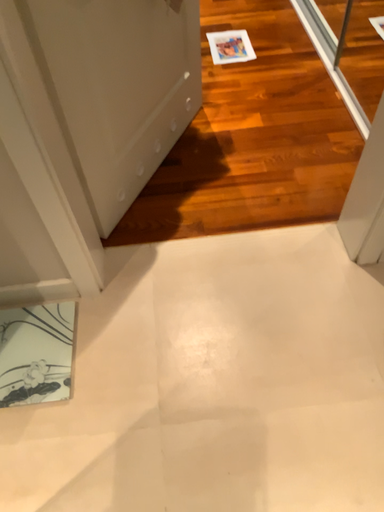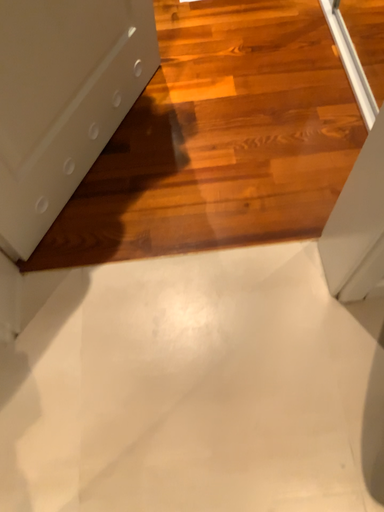
Question: How did the camera likely rotate when shooting the video?

Choices:
 (A) rotated downward
 (B) rotated upward

Answer: (A)